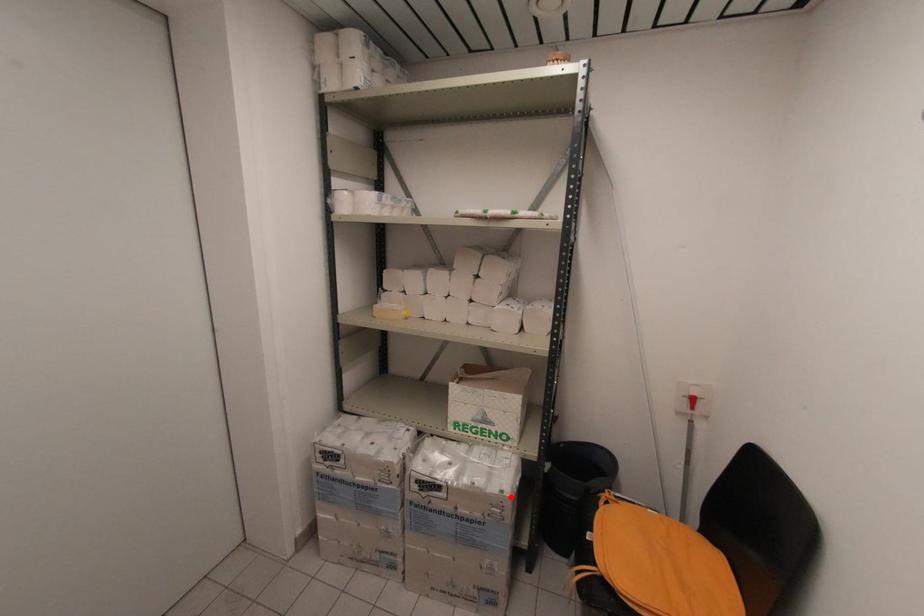
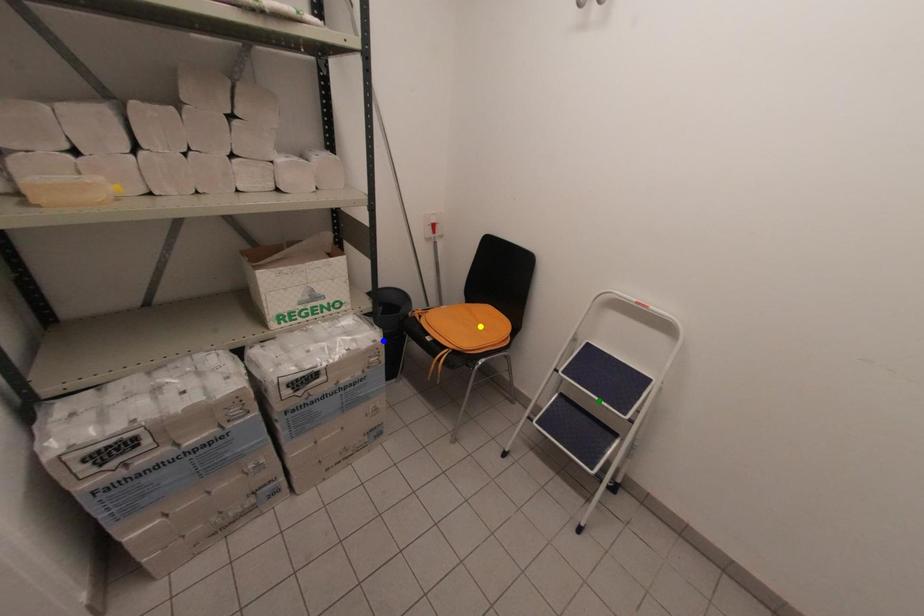
Question: I am providing you with two images of the same scene from different viewpoints. A red point is marked on the first image. You are given multiple points on the second image. Which point in image 2 is actually the same real-world point as the red point in image 1?

Choices:
 (A) yellow point
 (B) green point
 (C) blue point

Answer: (C)